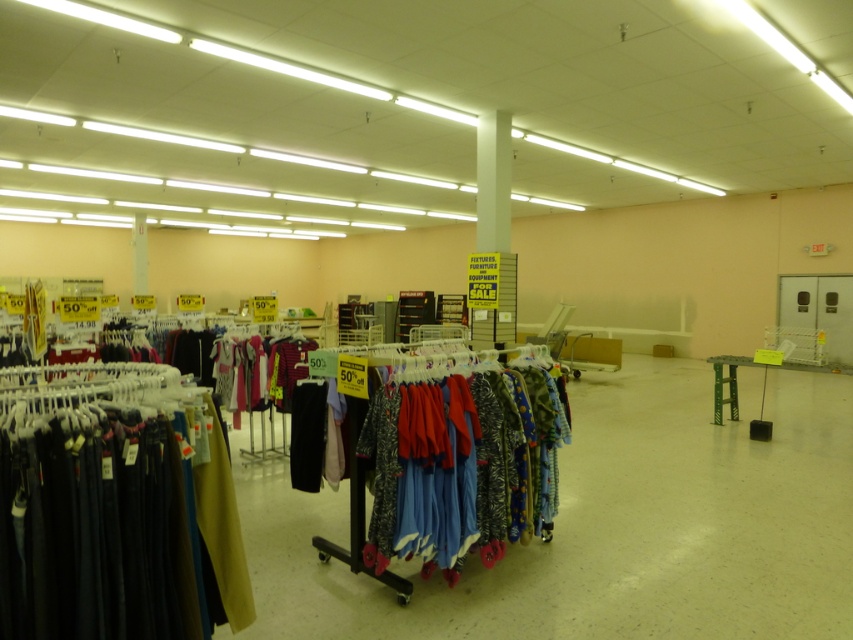
Describe the element at coordinates (114, 508) in the screenshot. The image size is (853, 640). I see `dark blue fabric pants at left` at that location.

You are a GUI agent. You are given a task and a screenshot of the screen. Output one action in this format:
    pyautogui.click(x=<x>, y=<y>)
    Task: Click on the dark blue fabric pants at left
    
    Given the screenshot: What is the action you would take?
    pyautogui.click(x=114, y=508)